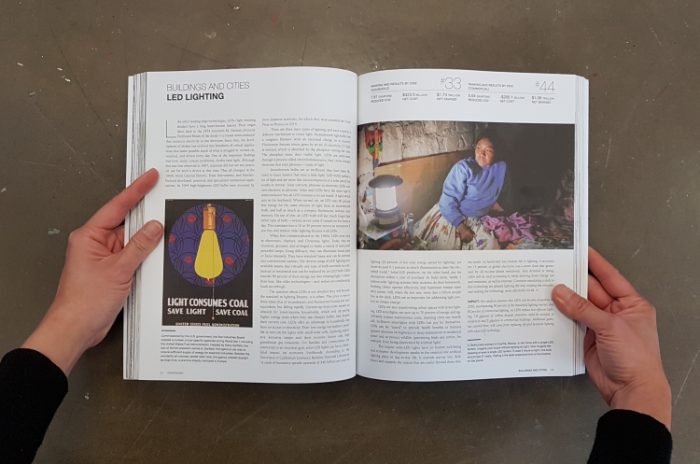
You are a GUI agent. You are given a task and a screenshot of the screen. Output one action in this format:
    pyautogui.click(x=<x>, y=<y>)
    Task: Click on the light
    Image resolution: width=700 pixels, height=464 pixels.
    Given the screenshot: What is the action you would take?
    pyautogui.click(x=386, y=200)